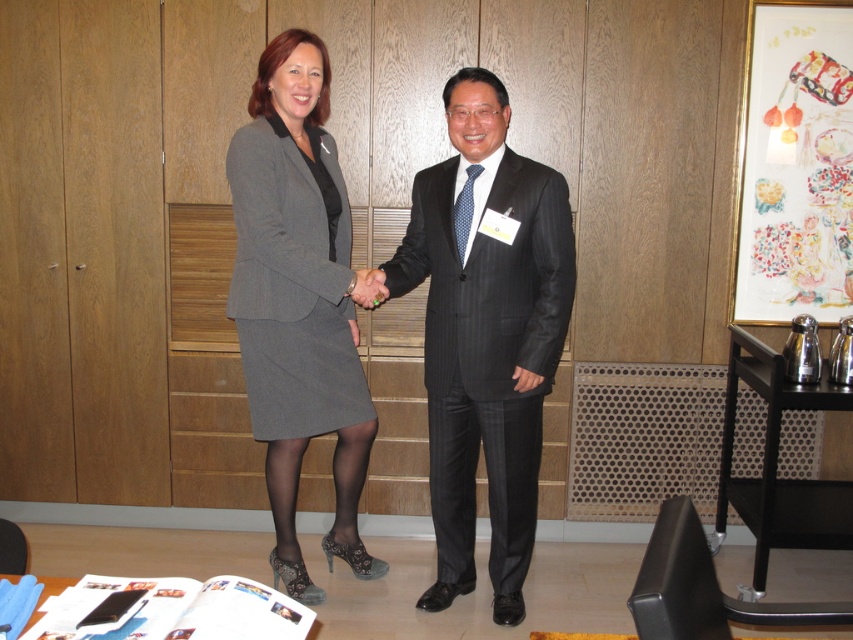
Is dark gray pinstripe suit at center taller than matte black hand at center?

Indeed, dark gray pinstripe suit at center has a greater height compared to matte black hand at center.

Consider the image. Does dark gray pinstripe suit at center have a larger size compared to matte black hand at center?

Indeed, dark gray pinstripe suit at center has a larger size compared to matte black hand at center.

This screenshot has height=640, width=853. I want to click on dark gray pinstripe suit at center, so click(x=486, y=333).

Image resolution: width=853 pixels, height=640 pixels. What are the coordinates of `dark gray pinstripe suit at center` in the screenshot? It's located at (486, 333).

Is point (322, 330) farther from camera compared to point (367, 280)?

That is True.

Can you confirm if gray wool skirt at center is wider than matte black hand at center?

Correct, the width of gray wool skirt at center exceeds that of matte black hand at center.

The image size is (853, 640). What do you see at coordinates (299, 301) in the screenshot?
I see `gray wool skirt at center` at bounding box center [299, 301].

The width and height of the screenshot is (853, 640). I want to click on gray wool skirt at center, so click(299, 301).

Is dark gray pinstripe suit at center closer to the viewer compared to gray wool skirt at center?

That is False.

Between point (560, 230) and point (341, 256), which one is positioned behind?

The point (341, 256) is more distant.

Where is `dark gray pinstripe suit at center`? This screenshot has width=853, height=640. dark gray pinstripe suit at center is located at coordinates (486, 333).